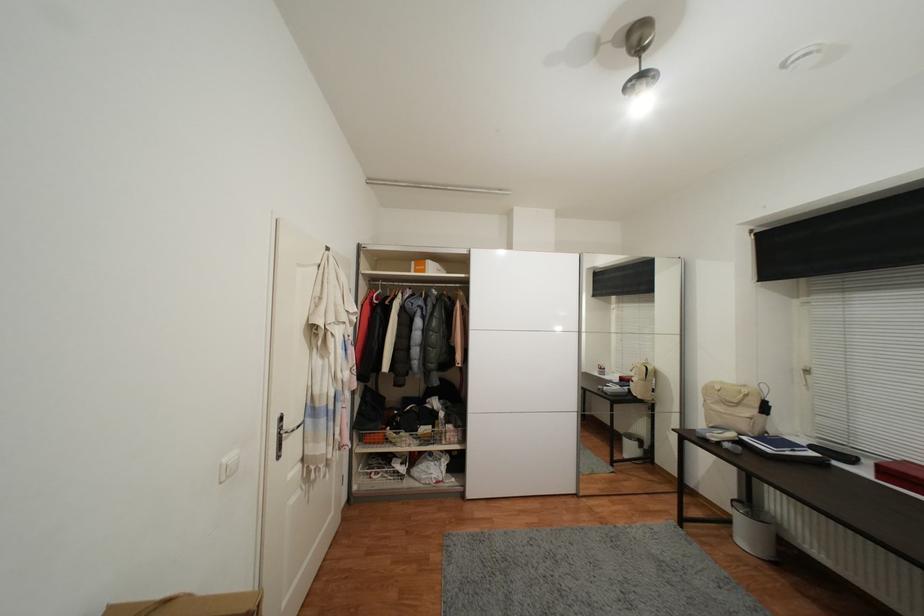
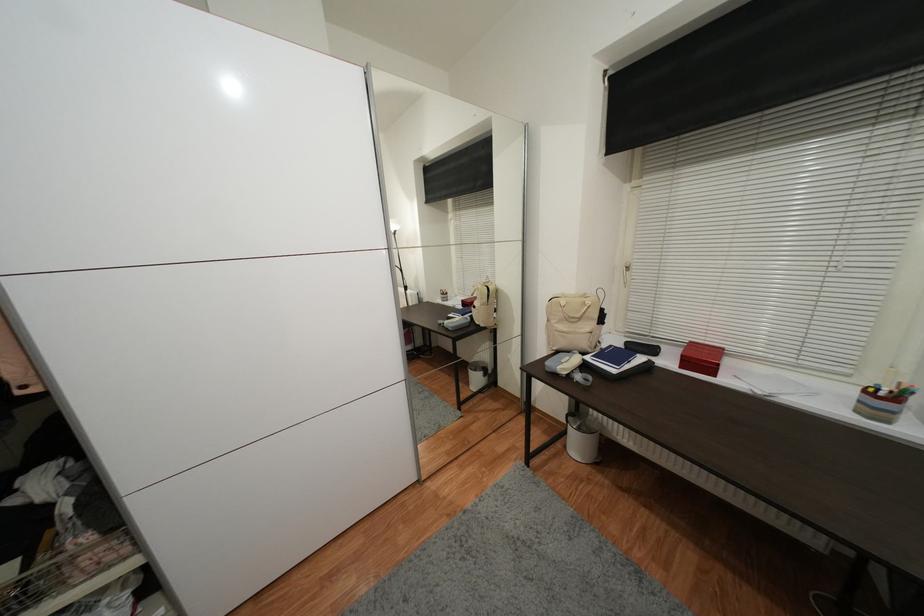
Find the pixel in the second image that matches pixel 848 292 in the first image.

(678, 167)